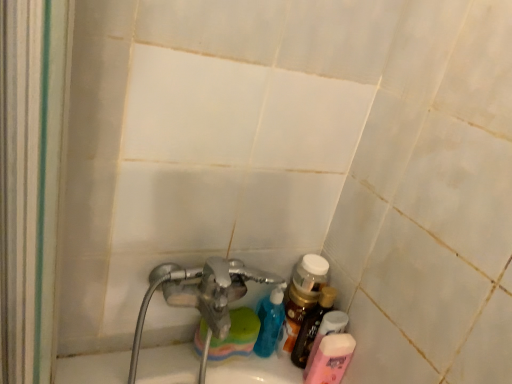
Question: From a real-world perspective, is pink matte lotion at lower right, the 2th toiletry positioned from the top, above or below translucent plastic bottle at lower right, placed as the 2th toiletry when sorted from bottom to top?

Choices:
 (A) below
 (B) above

Answer: (A)

Question: From the image's perspective, is pink matte lotion at lower right, the 2th toiletry positioned from the top, located above or below translucent plastic bottle at lower right, placed as the 2th toiletry when sorted from bottom to top?

Choices:
 (A) below
 (B) above

Answer: (A)

Question: Which is farther from the translucent plastic bottle at lower right, placed as the 2th toiletry when sorted from bottom to top?

Choices:
 (A) pink matte lotion at lower right, marked as the first toiletry in a bottom-to-top arrangement
 (B) translucent plastic bottle at lower right

Answer: (B)

Question: Based on their relative distances, which object is nearer to the translucent plastic bottle at lower right, the 1th toiletry when ordered from top to bottom?

Choices:
 (A) translucent plastic bottle at lower right
 (B) pink matte lotion at lower right, the 2th toiletry positioned from the top

Answer: (B)